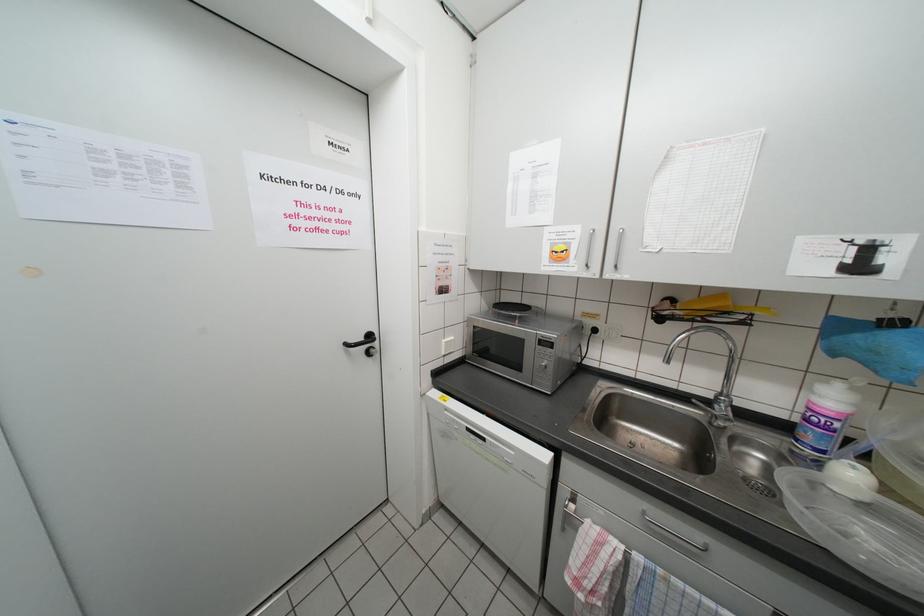
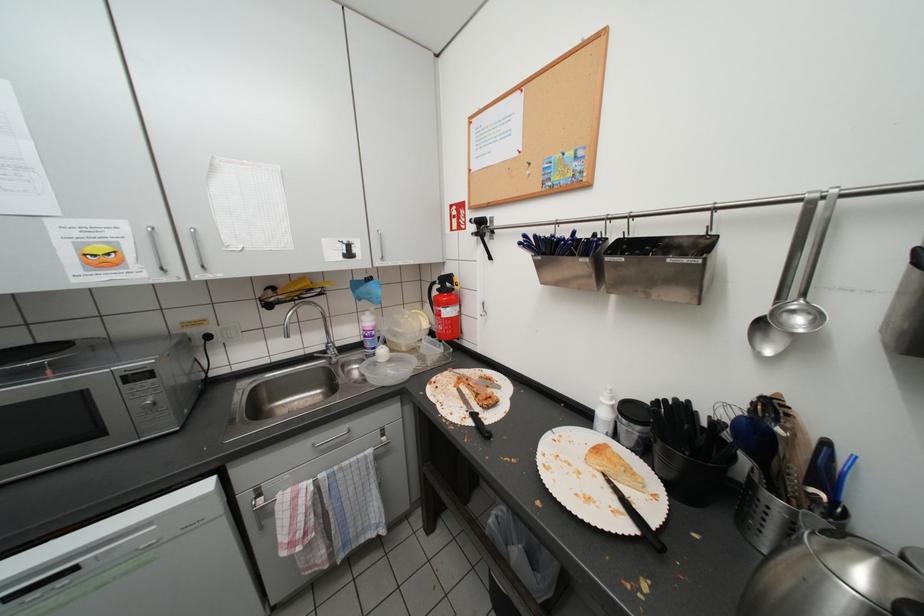
Question: How did the camera likely rotate?

Choices:
 (A) Left
 (B) Right
 (C) Up
 (D) Down

Answer: (B)